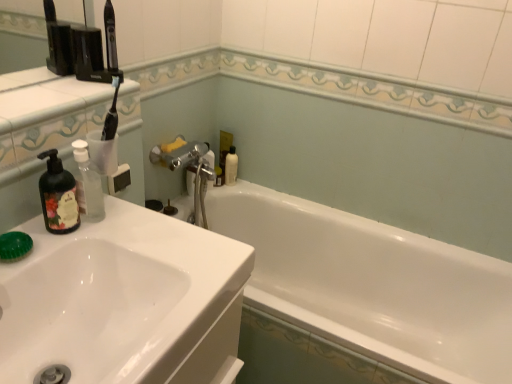
At what (x,y) coordinates should I click in order to perform the action: click on free space to the right of matte black soap dispenser at left. Please return your answer as a coordinate pair (x, y). This screenshot has height=384, width=512. Looking at the image, I should click on (128, 232).